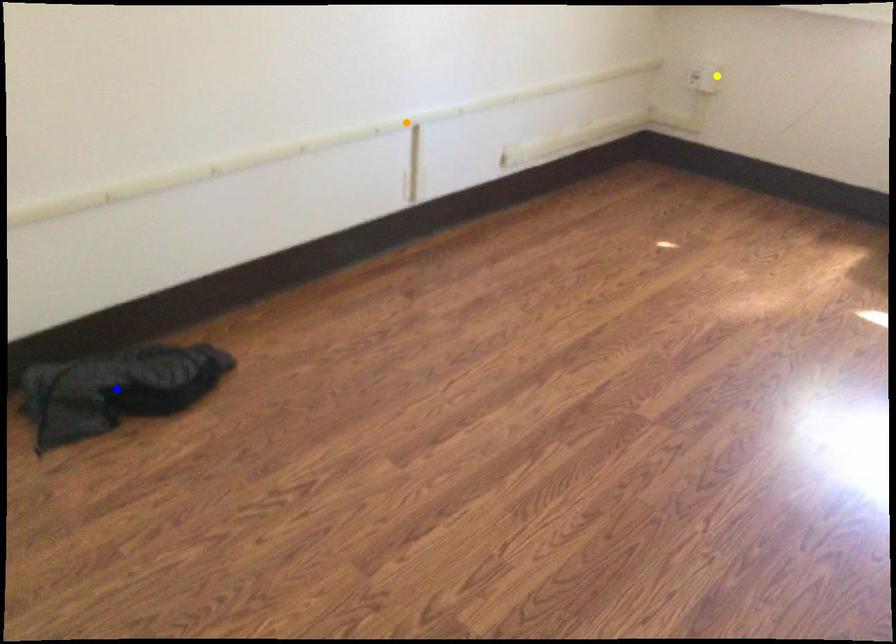
Consider the image. Order these from nearest to farthest:
blue point
yellow point
orange point

blue point
orange point
yellow point